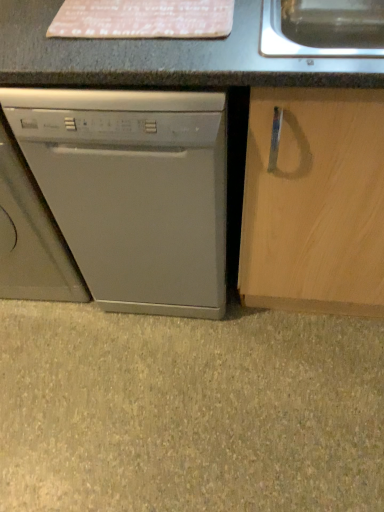
Locate an element on the screen. This screenshot has height=512, width=384. free space in front of satin silver dishwasher at left is located at coordinates (178, 382).